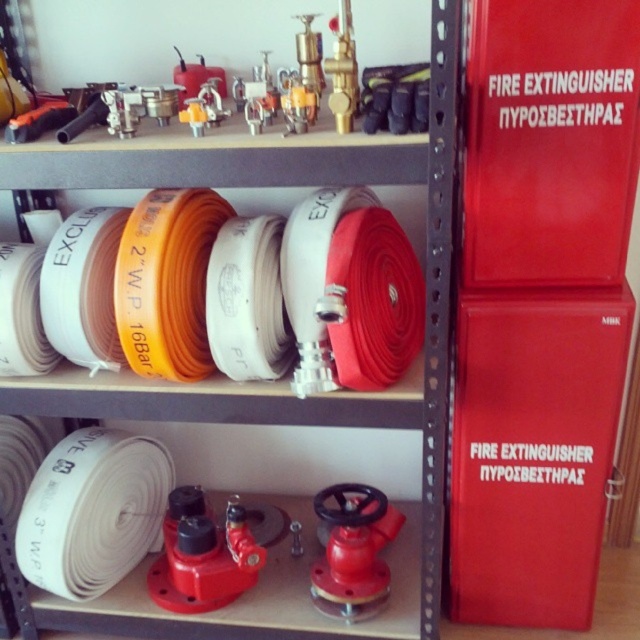
Question: Which of the following is the closest to the observer?

Choices:
 (A) red matte fire extinguisher at center right
 (B) white rubber hose at upper center
 (C) red matte fire extinguisher at right

Answer: (B)

Question: Is red matte fire extinguisher at center right positioned behind white rubber hose at upper center?

Choices:
 (A) yes
 (B) no

Answer: (A)

Question: Is red matte fire extinguisher at center right positioned at the back of white rubber hose at upper center?

Choices:
 (A) yes
 (B) no

Answer: (A)

Question: Which object is the farthest from the white rubber hose at upper center?

Choices:
 (A) red matte fire extinguisher at right
 (B) red matte fire extinguisher at center right

Answer: (A)

Question: Observing the image, what is the correct spatial positioning of red matte fire extinguisher at center right in reference to red matte fire extinguisher at right?

Choices:
 (A) above
 (B) below

Answer: (B)

Question: Which point is closer to the camera taking this photo?

Choices:
 (A) (397, 152)
 (B) (499, 148)

Answer: (A)